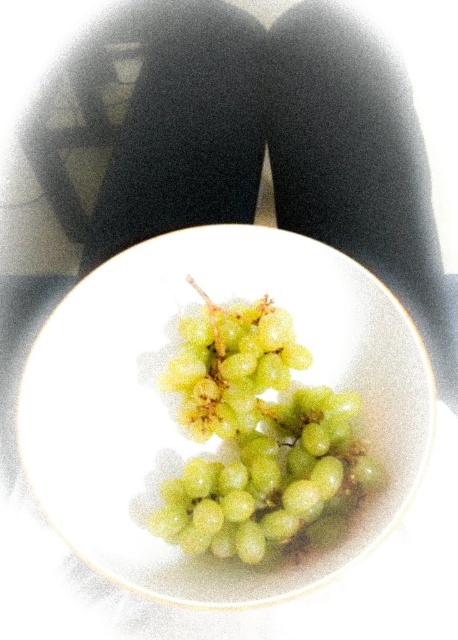
Can you confirm if white glossy platter at center is positioned below green matte grapes at center?

Incorrect, white glossy platter at center is not positioned below green matte grapes at center.

Does white glossy platter at center appear on the right side of green matte grapes at center?

In fact, white glossy platter at center is to the left of green matte grapes at center.

Who is more forward, (419, 464) or (379, 484)?

Point (419, 464) is more forward.

Where is `white glossy platter at center`? This screenshot has height=640, width=458. white glossy platter at center is located at coordinates (174, 403).